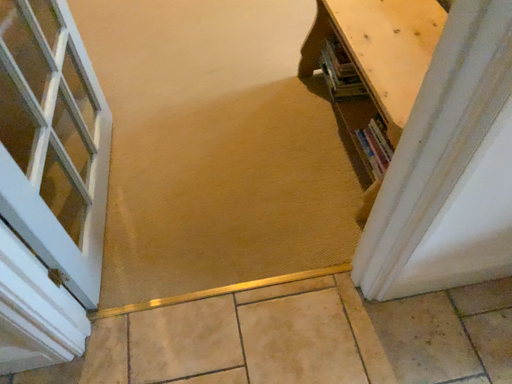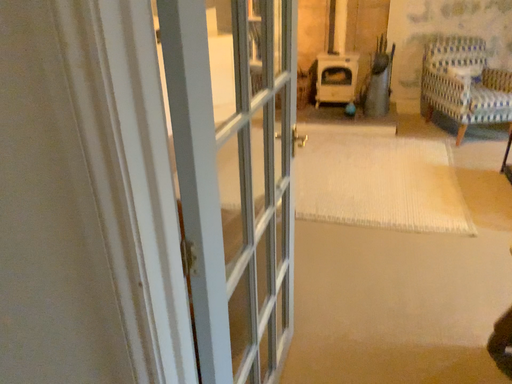
Question: How did the camera likely rotate when shooting the video?

Choices:
 (A) rotated left
 (B) rotated right

Answer: (A)